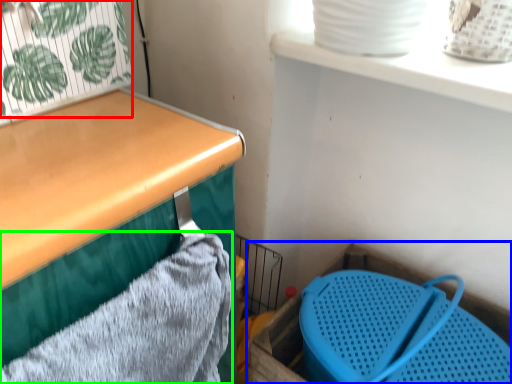
Question: Estimate the real-world distances between objects in this image. Which object is farther from plant (highlighted by a red box), storage box (highlighted by a blue box) or bath towel (highlighted by a green box)?

Choices:
 (A) storage box
 (B) bath towel

Answer: (A)